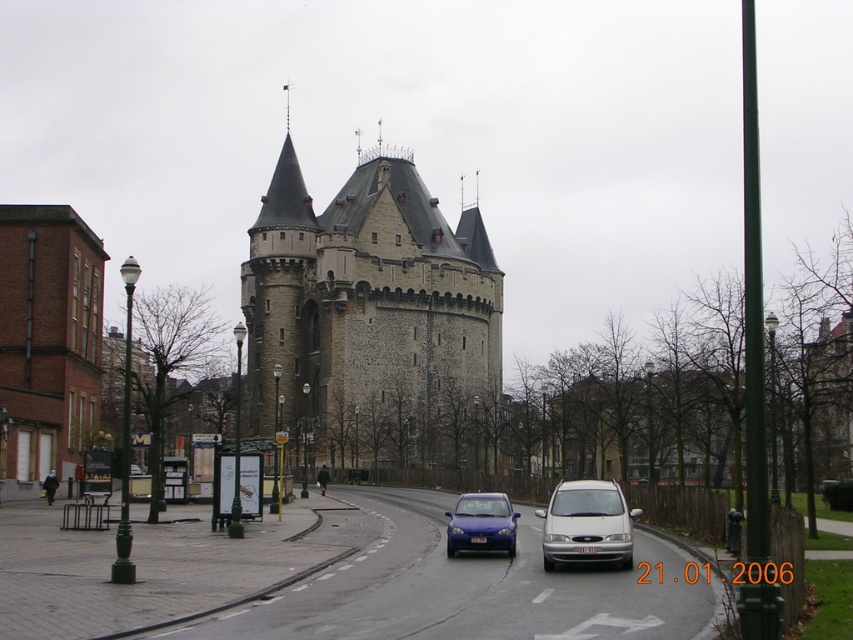
You are a pedestrian standing on the sidewalk next to the road. You see the silver metallic van at center and the matte blue car at center. Which vehicle is nearer to you?

The silver metallic van at center is closer to the viewer than the matte blue car at center, so the silver metallic van at center is nearer to you.

You are a pedestrian standing on the sidewalk next to the road. You see the silver metallic van at center and the matte blue car at center. Which vehicle is closer to you?

The matte blue car at center is closer to you because the silver metallic van at center is located above it, indicating it is further back along the road.